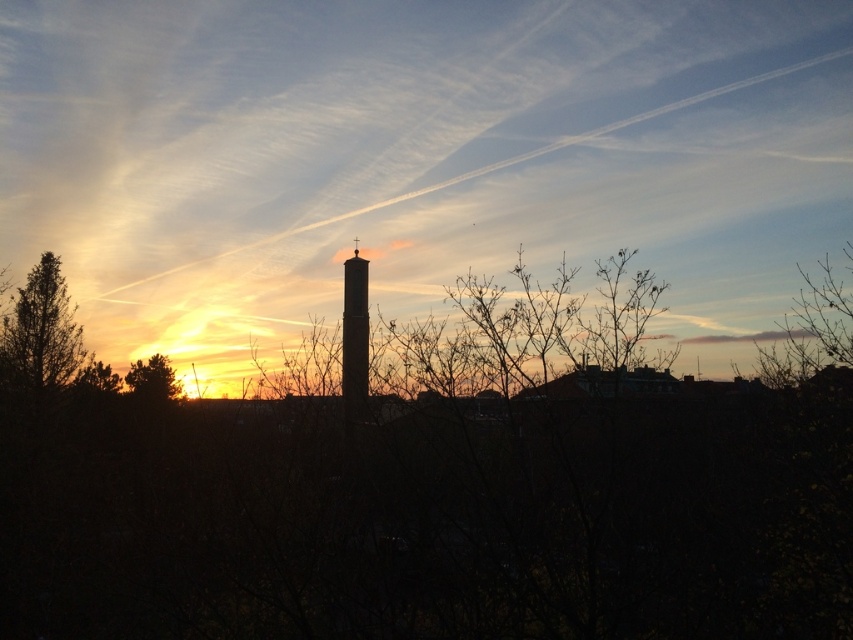
Can you confirm if bare branches at right is smaller than black matte chimney at center?

Incorrect, bare branches at right is not smaller in size than black matte chimney at center.

This screenshot has width=853, height=640. I want to click on bare branches at right, so 811,328.

The image size is (853, 640). What do you see at coordinates (811, 328) in the screenshot? I see `bare branches at right` at bounding box center [811, 328].

This screenshot has width=853, height=640. Identify the location of bare branches at right. (811, 328).

This screenshot has height=640, width=853. I want to click on bare branches at right, so click(x=811, y=328).

Between bare branches at right and green leafy tree at left, which one appears on the left side from the viewer's perspective?

Positioned to the left is green leafy tree at left.

Describe the element at coordinates (811, 328) in the screenshot. This screenshot has width=853, height=640. I see `bare branches at right` at that location.

Identify the location of bare branches at right. This screenshot has height=640, width=853. (811, 328).

The height and width of the screenshot is (640, 853). What do you see at coordinates (39, 332) in the screenshot? I see `green textured tree at left` at bounding box center [39, 332].

Who is higher up, green textured tree at left or bare branches at right?

bare branches at right is higher up.

You are a GUI agent. You are given a task and a screenshot of the screen. Output one action in this format:
    pyautogui.click(x=<x>, y=<y>)
    Task: Click on the green textured tree at left
    The width and height of the screenshot is (853, 640).
    Given the screenshot: What is the action you would take?
    pyautogui.click(x=39, y=332)